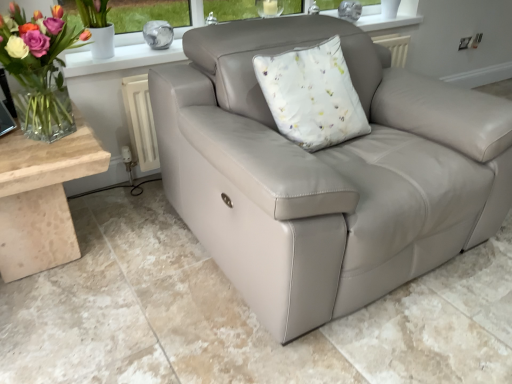
Question: Is clear glass vase at left placed right next to beige marble table at lower left?

Choices:
 (A) yes
 (B) no

Answer: (B)

Question: Is clear glass vase at left facing away from beige marble table at lower left?

Choices:
 (A) no
 (B) yes

Answer: (A)

Question: Is clear glass vase at left at the right side of beige marble table at lower left?

Choices:
 (A) yes
 (B) no

Answer: (A)

Question: Is the depth of clear glass vase at left greater than that of beige marble table at lower left?

Choices:
 (A) no
 (B) yes

Answer: (A)

Question: Is clear glass vase at left bigger than beige marble table at lower left?

Choices:
 (A) yes
 (B) no

Answer: (B)

Question: Considering the positions of matte leather couch at center and beige marble table at lower left in the image, is matte leather couch at center wider or thinner than beige marble table at lower left?

Choices:
 (A) thin
 (B) wide

Answer: (B)

Question: Would you say matte leather couch at center is to the left or to the right of beige marble table at lower left in the picture?

Choices:
 (A) left
 (B) right

Answer: (B)

Question: From their relative heights in the image, would you say matte leather couch at center is taller or shorter than beige marble table at lower left?

Choices:
 (A) tall
 (B) short

Answer: (B)

Question: Is matte leather couch at center bigger or smaller than beige marble table at lower left?

Choices:
 (A) small
 (B) big

Answer: (B)

Question: Is point (52, 134) positioned closer to the camera than point (0, 238)?

Choices:
 (A) farther
 (B) closer

Answer: (B)

Question: Is clear glass vase at left situated inside beige marble table at lower left or outside?

Choices:
 (A) outside
 (B) inside

Answer: (A)

Question: From the image's perspective, is clear glass vase at left above or below beige marble table at lower left?

Choices:
 (A) above
 (B) below

Answer: (A)

Question: Considering the positions of clear glass vase at left and beige marble table at lower left in the image, is clear glass vase at left bigger or smaller than beige marble table at lower left?

Choices:
 (A) big
 (B) small

Answer: (B)

Question: Is beige marble table at lower left spatially inside matte leather couch at center, or outside of it?

Choices:
 (A) outside
 (B) inside

Answer: (A)

Question: From a real-world perspective, is beige marble table at lower left physically located above or below matte leather couch at center?

Choices:
 (A) above
 (B) below

Answer: (A)